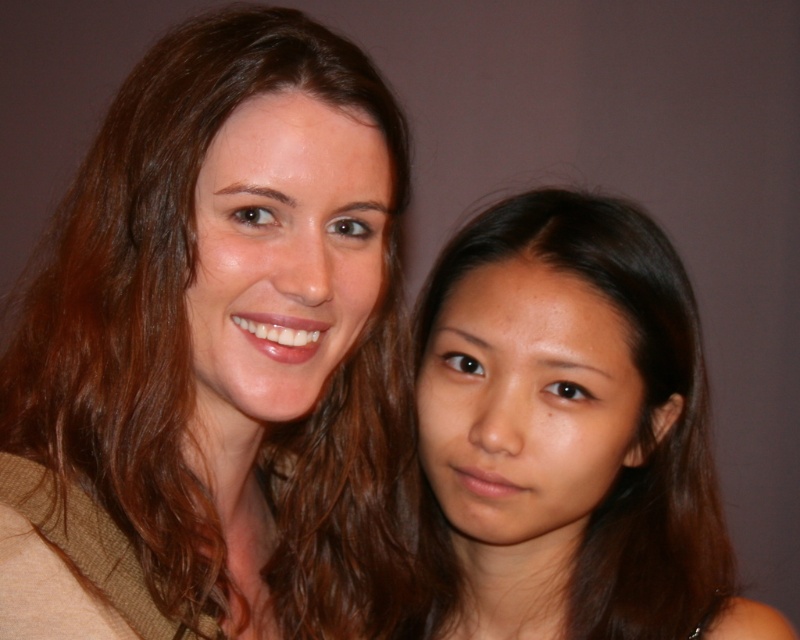
Question: Does brown hair at center come behind smooth brown hair at center?

Choices:
 (A) no
 (B) yes

Answer: (A)

Question: Does brown hair at center appear over smooth brown hair at center?

Choices:
 (A) yes
 (B) no

Answer: (A)

Question: Which point is closer to the camera?

Choices:
 (A) smooth brown hair at center
 (B) brown hair at center

Answer: (B)

Question: In this image, where is brown hair at center located relative to smooth brown hair at center?

Choices:
 (A) below
 (B) above

Answer: (B)